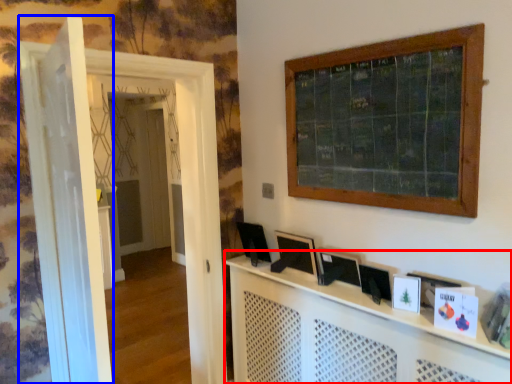
Question: Which object is closer to the camera taking this photo, computer desk (highlighted by a red box) or door (highlighted by a blue box)?

Choices:
 (A) computer desk
 (B) door

Answer: (B)